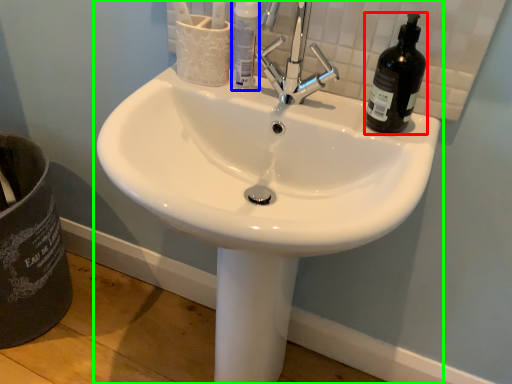
Question: Considering the real-world distances, which object is closest to beer bottle (highlighted by a red box)? bottle (highlighted by a blue box) or sink (highlighted by a green box).

Choices:
 (A) bottle
 (B) sink

Answer: (A)